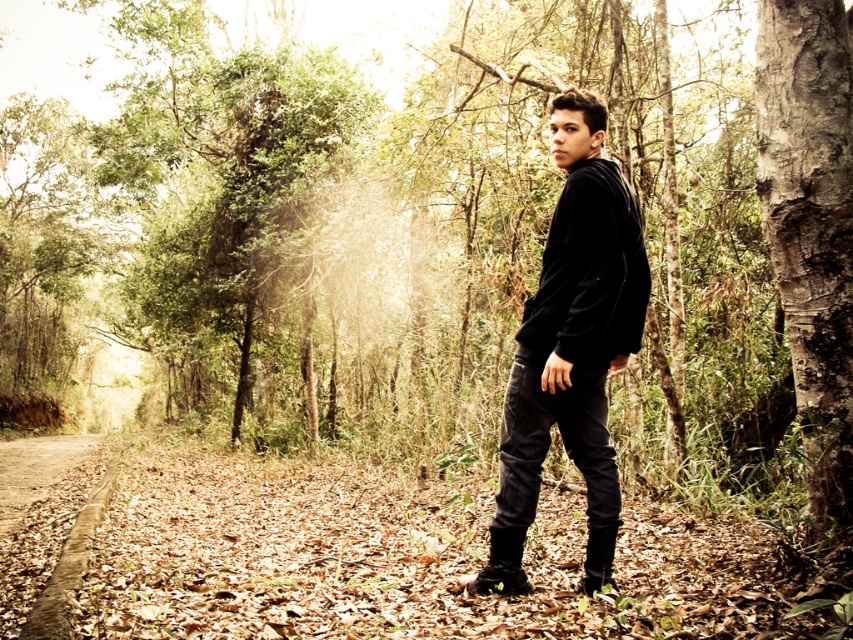
You are trying to decide which footwear to wear for a hike. You have the leather boots at lower center and the black suede boot at lower center. Which one has a wider base for better stability?

The leather boots at lower center have a wider base for better stability since their width is larger than the black suede boot at lower center.